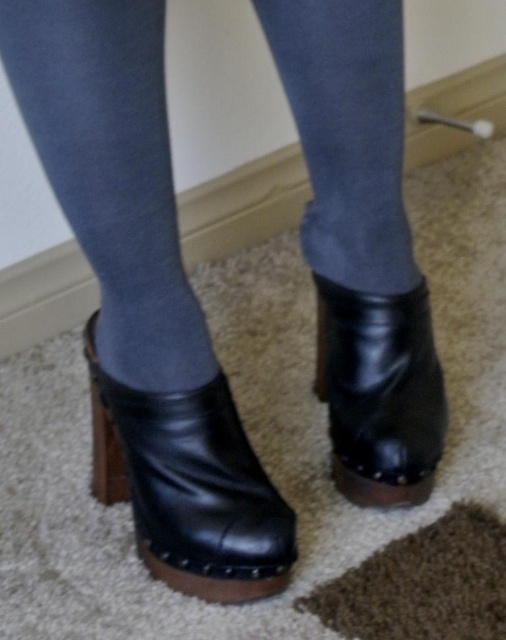
Question: Does denim jeans at center appear on the right side of black leather boot at lower left?

Choices:
 (A) no
 (B) yes

Answer: (B)

Question: Which object is farther from the camera taking this photo?

Choices:
 (A) denim jeans at center
 (B) black leather boot at lower left
 (C) black leather boot at center

Answer: (C)

Question: Considering the relative positions of black leather boot at lower left and black leather boot at center in the image provided, where is black leather boot at lower left located with respect to black leather boot at center?

Choices:
 (A) below
 (B) above

Answer: (A)

Question: Which of the following is the closest to the observer?

Choices:
 (A) black leather boot at center
 (B) black leather boot at lower left
 (C) denim jeans at center

Answer: (C)

Question: Among these points, which one is nearest to the camera?

Choices:
 (A) (338, 81)
 (B) (389, 436)
 (C) (97, 394)

Answer: (A)

Question: From the image, what is the correct spatial relationship of denim jeans at center in relation to black leather boot at lower left?

Choices:
 (A) left
 (B) right

Answer: (B)